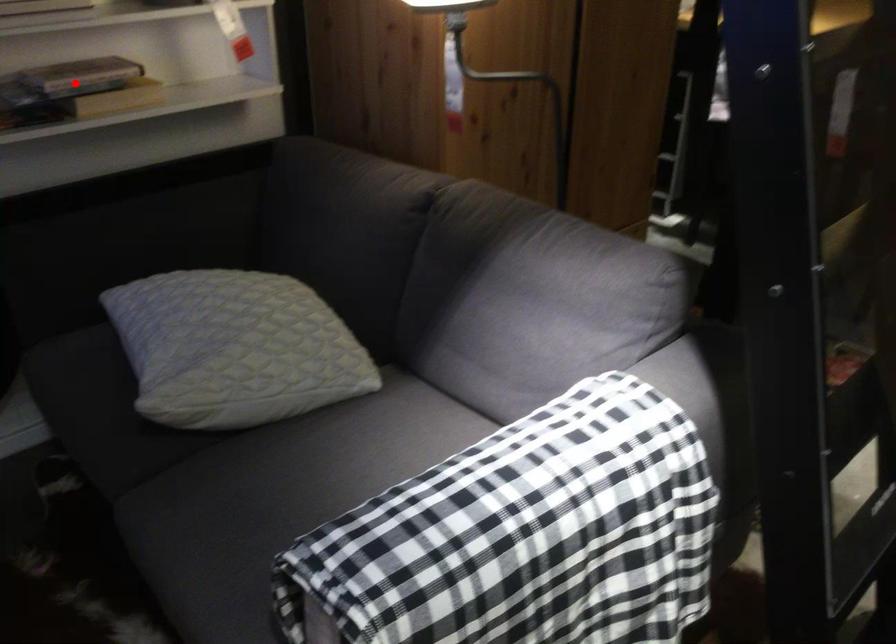
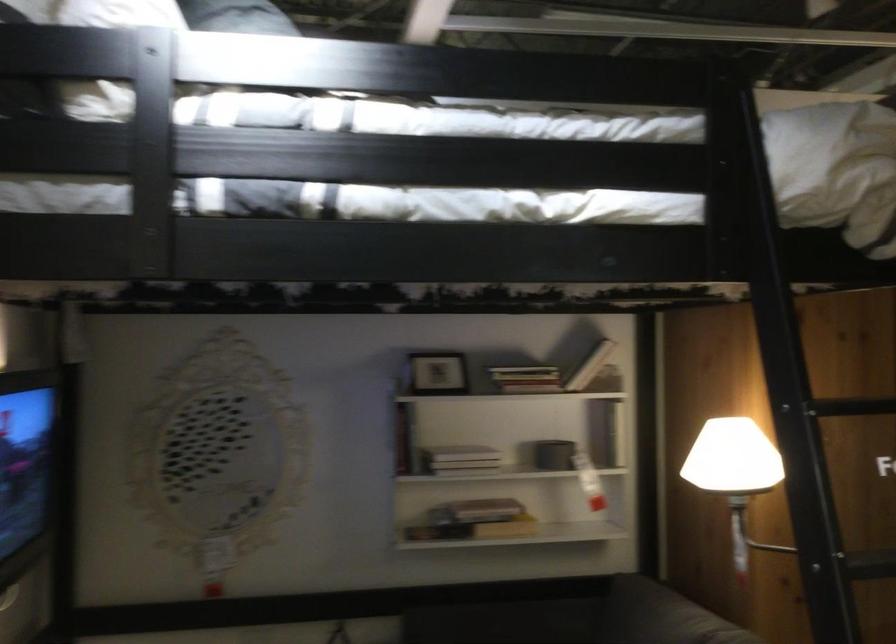
Question: I am providing you with two images of the same scene from different viewpoints. In image1, a red point is highlighted. Considering the same 3D point in image2, which of the following is correct?

Choices:
 (A) It is closer
 (B) It is farther

Answer: (B)